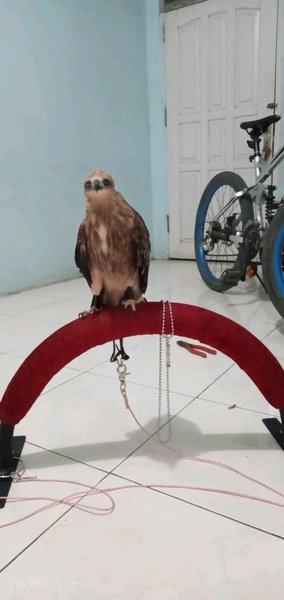
This screenshot has height=600, width=284. I want to click on door, so click(x=208, y=39).